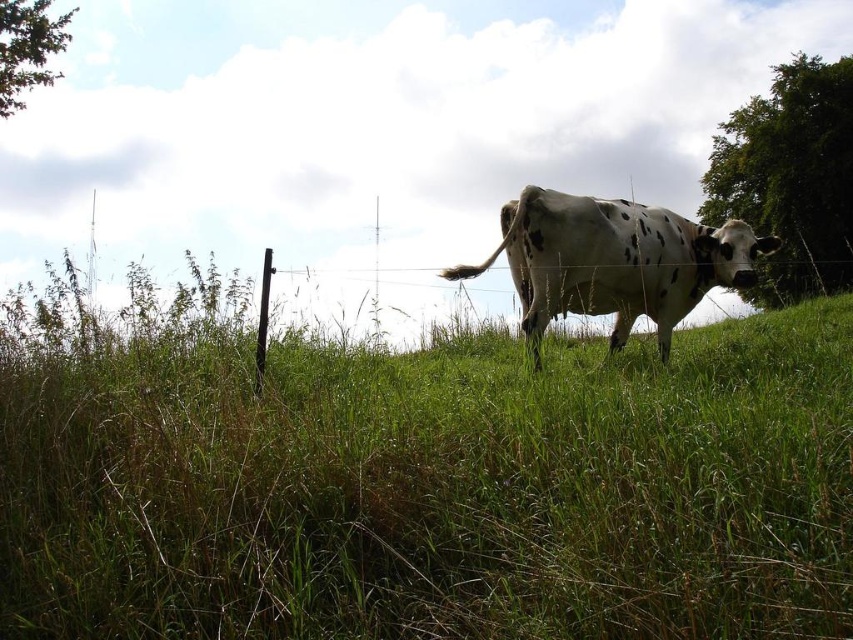
Question: Which of the following is the farthest from the observer?

Choices:
 (A) white spotted cow at center
 (B) green leafy tree at upper right
 (C) green leafy tree at upper left
 (D) green grassy at center

Answer: (B)

Question: Does green grassy at center appear over green leafy tree at upper right?

Choices:
 (A) no
 (B) yes

Answer: (A)

Question: Which object is farther from the camera taking this photo?

Choices:
 (A) green grassy at center
 (B) green leafy tree at upper left

Answer: (B)

Question: Can you confirm if green grassy at center is positioned above white spotted cow at center?

Choices:
 (A) yes
 (B) no

Answer: (B)

Question: Which object is closer to the camera taking this photo?

Choices:
 (A) white spotted cow at center
 (B) green leafy tree at upper left

Answer: (A)

Question: Does green grassy at center appear on the left side of green leafy tree at upper right?

Choices:
 (A) no
 (B) yes

Answer: (B)